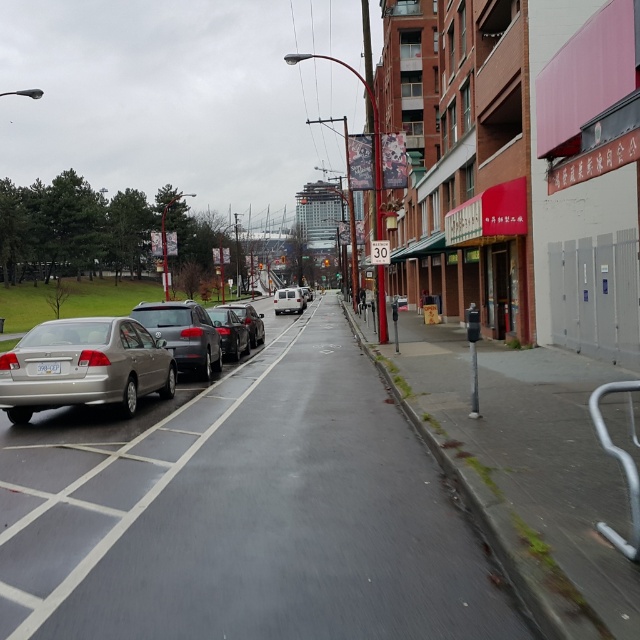
You are a pedestrian standing on the sidewalk and want to cross the street to reach a store on the other side. There is a satin silver sedan at left and a white matte van at center parked on the street. Which vehicle should you avoid stepping over when crossing?

You should avoid stepping over the satin silver sedan at left because it is positioned on the left side of the white matte van at center, meaning it is closer to the sidewalk where you are standing.

You are a delivery person trying to navigate through the street. You see the satin silver sedan at left and the white matte van at center. Which vehicle is positioned lower in the image?

The satin silver sedan at left is positioned below the white matte van at center, so it is lower in the image.